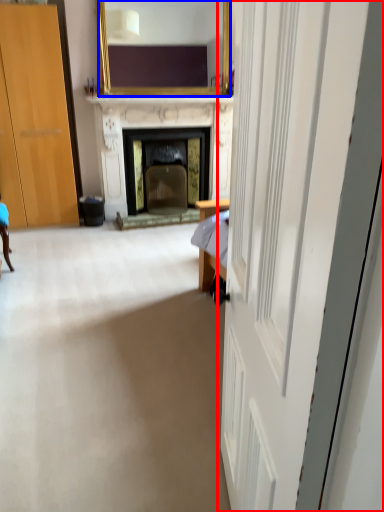
Question: Which object appears closest to the camera in this image, door (highlighted by a red box) or mirror (highlighted by a blue box)?

Choices:
 (A) door
 (B) mirror

Answer: (A)